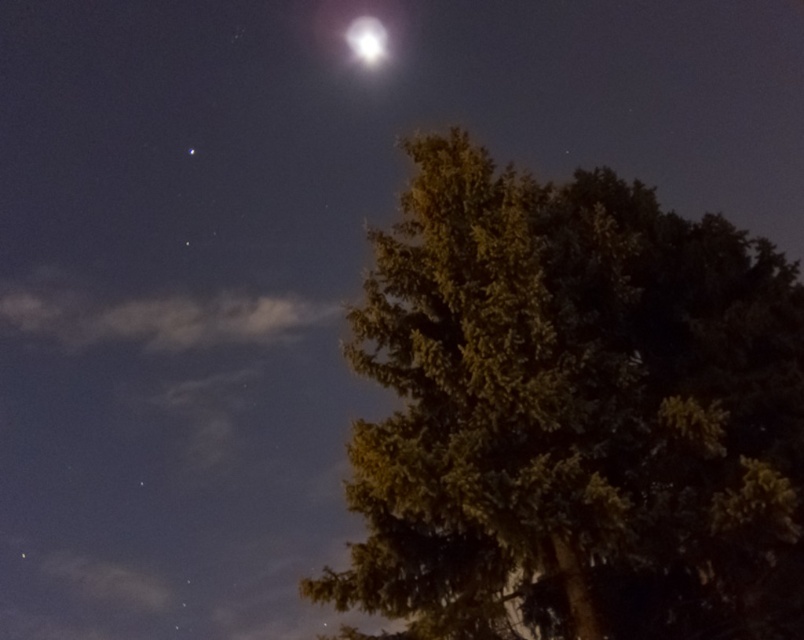
Does green textured tree at right have a lesser height compared to bright white crystal at upper center?

Incorrect, green textured tree at right's height does not fall short of bright white crystal at upper center's.

Is green textured tree at right to the left of bright white crystal at upper center from the viewer's perspective?

In fact, green textured tree at right is to the right of bright white crystal at upper center.

This screenshot has width=804, height=640. What do you see at coordinates (573, 413) in the screenshot?
I see `green textured tree at right` at bounding box center [573, 413].

Where is `green textured tree at right`? This screenshot has height=640, width=804. green textured tree at right is located at coordinates (573, 413).